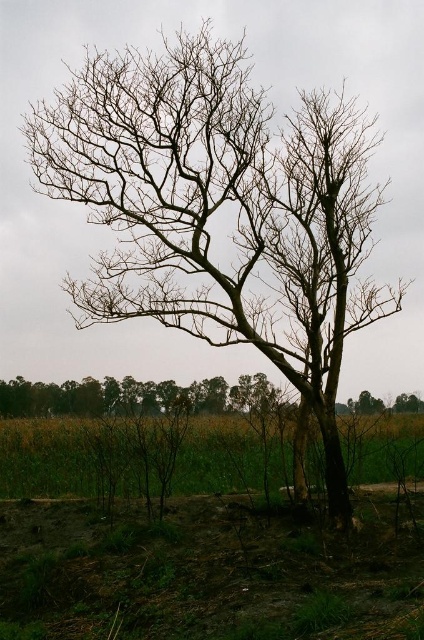
Question: Which point appears farthest from the camera in this image?

Choices:
 (A) (257, 381)
 (B) (194, 474)

Answer: (B)

Question: Observing the image, what is the correct spatial positioning of green grass at lower center in reference to brown leafless tree at center?

Choices:
 (A) above
 (B) below

Answer: (B)

Question: Is green grass at lower center to the right of brown leafless tree at center from the viewer's perspective?

Choices:
 (A) yes
 (B) no

Answer: (A)

Question: Observing the image, what is the correct spatial positioning of green grass at lower center in reference to brown leafless tree at center?

Choices:
 (A) below
 (B) above

Answer: (A)